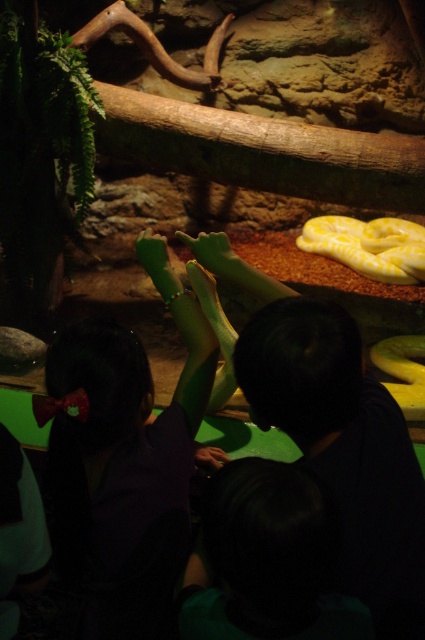
Question: Which of these objects is positioned closest to the yellow matte snake at center?

Choices:
 (A) dark purple shirt at center
 (B) yellow matte snake at upper center

Answer: (B)

Question: Which object is positioned closest to the yellow matte snake at upper center?

Choices:
 (A) yellow matte snake at center
 (B) dark purple shirt at center

Answer: (A)

Question: Which point appears farthest from the camera in this image?

Choices:
 (A) (173, 397)
 (B) (424, 392)
 (C) (404, 282)

Answer: (C)

Question: Does dark purple shirt at center have a smaller size compared to yellow matte snake at upper center?

Choices:
 (A) yes
 (B) no

Answer: (A)

Question: From the image, what is the correct spatial relationship of dark purple shirt at center in relation to yellow matte snake at center?

Choices:
 (A) above
 (B) below

Answer: (B)

Question: Observing the image, what is the correct spatial positioning of dark purple shirt at center in reference to yellow matte snake at center?

Choices:
 (A) above
 (B) below

Answer: (B)